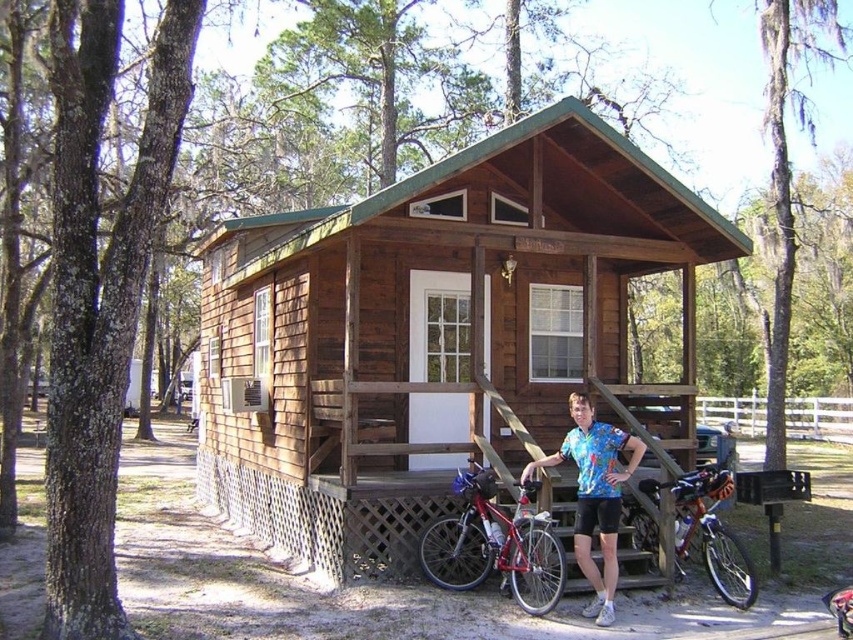
Does brown wooden cabin at center come in front of shiny red bicycle at center?

No, it is behind shiny red bicycle at center.

Is point (514, 337) positioned in front of point (463, 480)?

No, it is not.

Find the location of a particular element. brown wooden cabin at center is located at coordinates point(434,333).

Which is more to the left, wooden stairs at center or shiny red bicycle at center?

wooden stairs at center is more to the left.

Is point (352, 556) positioned behind point (498, 518)?

Yes, point (352, 556) is behind point (498, 518).

Is point (364, 483) farther from viewer compared to point (480, 516)?

That is True.

This screenshot has width=853, height=640. What are the coordinates of `wooden stairs at center` in the screenshot? It's located at (378, 520).

Which is more to the left, brown wooden cabin at center or wooden stairs at center?

wooden stairs at center is more to the left.

Is point (480, 326) less distant than point (639, 428)?

Yes, point (480, 326) is closer to viewer.

The height and width of the screenshot is (640, 853). Describe the element at coordinates (434, 333) in the screenshot. I see `brown wooden cabin at center` at that location.

I want to click on brown wooden cabin at center, so click(x=434, y=333).